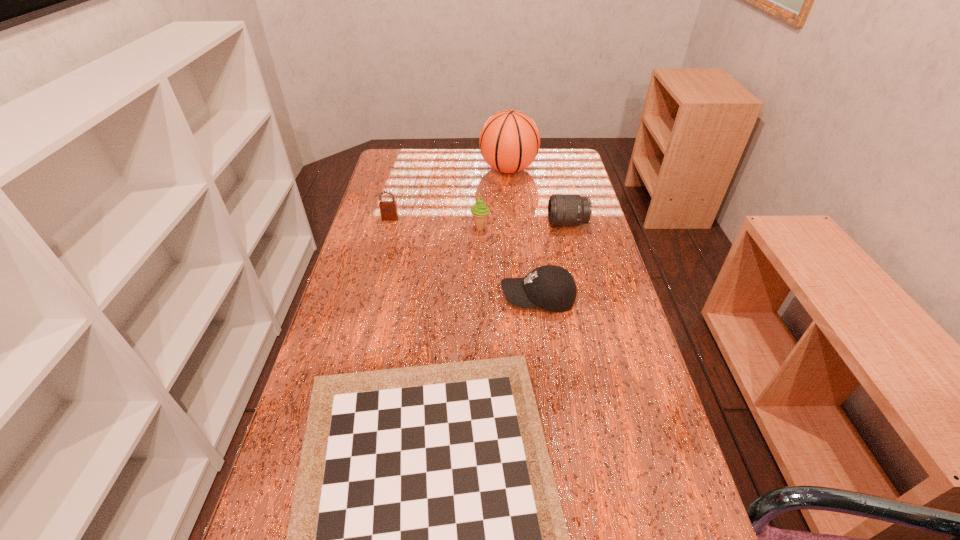
Find the location of `free space between the padlock and the icecream`. free space between the padlock and the icecream is located at coordinates (435, 223).

You are a GUI agent. You are given a task and a screenshot of the screen. Output one action in this format:
    pyautogui.click(x=<x>, y=<y>)
    Task: Click on the empty location between the fifth farthest object and the farthest object
    
    Given the screenshot: What is the action you would take?
    pyautogui.click(x=523, y=234)

Where is `free space between the icecream and the padlock`? This screenshot has width=960, height=540. free space between the icecream and the padlock is located at coordinates (435, 223).

This screenshot has height=540, width=960. What are the coordinates of `object that can be found as the fifth closest to the padlock` in the screenshot? It's located at (426, 539).

Where is `object that stands as the fifth closest to the tallest object`? This screenshot has width=960, height=540. object that stands as the fifth closest to the tallest object is located at coordinates (426, 539).